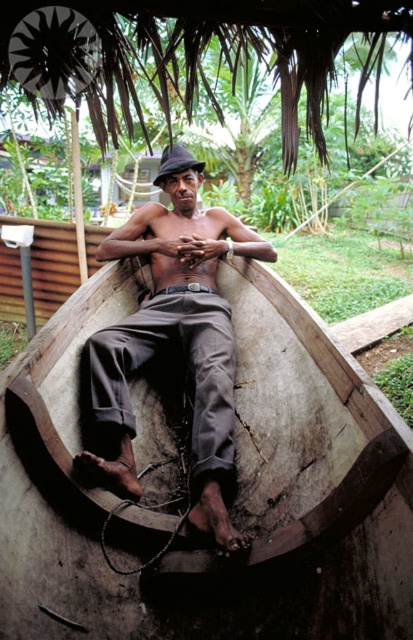
In the scene shown: You are standing next to the wooden canoe at center and want to place a small potted plant on the edge of the boat. However, there is already a pair of matte brown pants at center. Where should you place the potted plant to ensure it doesn not fall into the water?

The wooden canoe at center is positioned under matte brown pants at center, so placing the potted plant on the edge of the wooden canoe at center away from the matte brown pants at center would prevent it from falling into the water.

You are standing at the edge of the wooden canoe at center. If you move forward 0.1 units in the direction of the point at coordinates point (x=237, y=483), will you still be on the wooden canoe at center?

The point (x=237, y=483) is on the wooden canoe at center. Moving forward 0.1 units in that direction would keep you on the wooden canoe at center since the point is already part of it.

You are standing in front of the wooden boat and want to place a small item on the closest point between the two points marked as point [87,310] and point [230,332]. Which point should you choose?

You should choose point [87,310] because it is closer to the viewer than point [230,332].